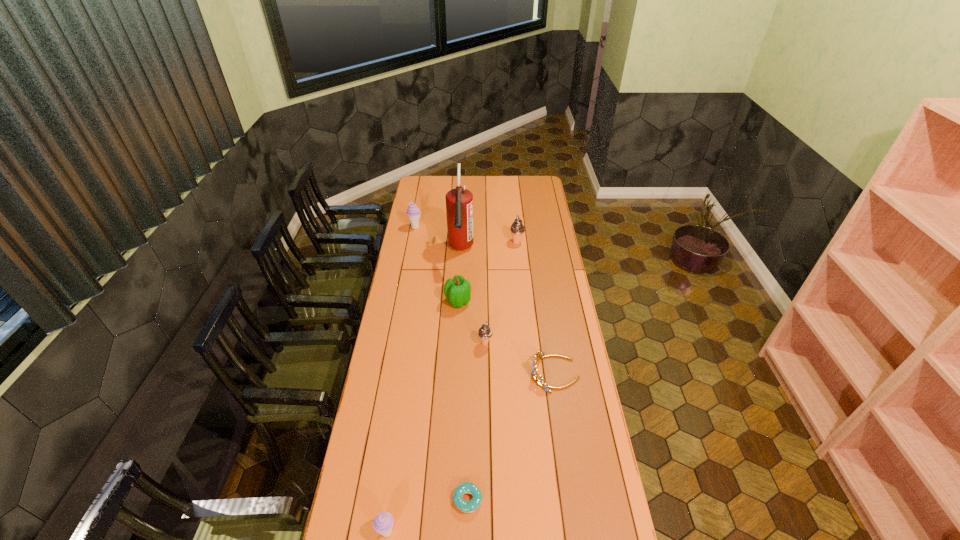
This screenshot has width=960, height=540. In order to click on free point located 0.060m on the front-facing side of the sixth farthest object in this screenshot , I will do `click(516, 374)`.

Identify the location of vacant region located on the front-facing side of the sixth farthest object. This screenshot has width=960, height=540. (454, 374).

This screenshot has width=960, height=540. In order to click on vacant area located 0.070m on the left of the shortest object in this screenshot , I will do (431, 500).

The width and height of the screenshot is (960, 540). I want to click on object present at the left edge, so click(x=413, y=212).

This screenshot has width=960, height=540. What are the coordinates of `object that is at the right edge` in the screenshot? It's located at [x=540, y=381].

Where is `vacant space at the far edge of the desktop`? This screenshot has width=960, height=540. vacant space at the far edge of the desktop is located at coordinates (501, 184).

Image resolution: width=960 pixels, height=540 pixels. I want to click on vacant space at the left edge of the desktop, so click(x=391, y=507).

You are a GUI agent. You are given a task and a screenshot of the screen. Output one action in this format:
    pyautogui.click(x=<x>, y=<y>)
    Task: Click on the vacant point at the right edge
    
    Given the screenshot: What is the action you would take?
    pyautogui.click(x=546, y=206)

Find the location of a particular element. Image resolution: width=960 pixels, height=540 pixels. free spot at the far left corner of the desktop is located at coordinates (430, 178).

Find the location of a particular element. free space that is in between the smaller chocolate icecream and the bigger chocolate icecream is located at coordinates (501, 293).